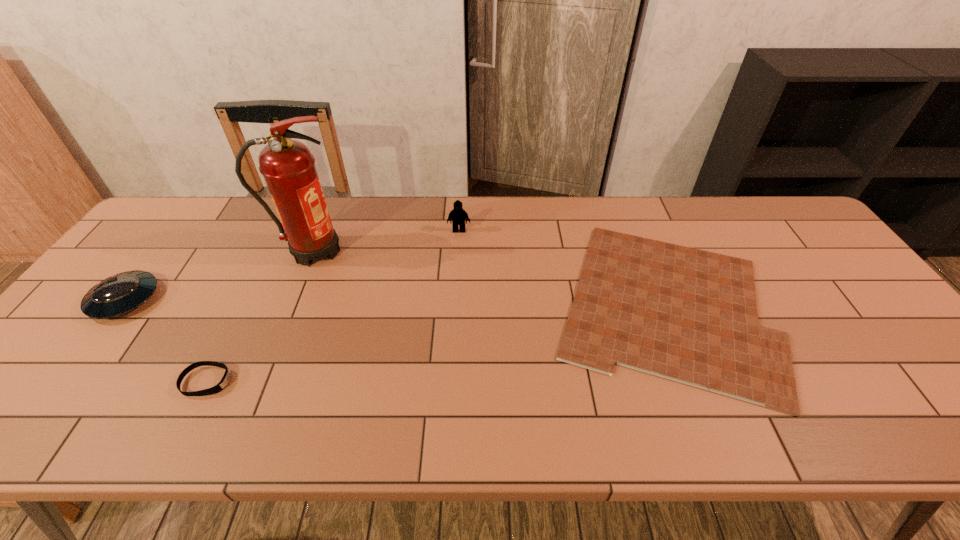
This screenshot has width=960, height=540. In order to click on free point located on the back of the leftmost object in this screenshot , I will do `click(186, 220)`.

Where is `vacant space located 0.400m on the display of the second shortest object`? This screenshot has height=540, width=960. vacant space located 0.400m on the display of the second shortest object is located at coordinates (408, 381).

Identify the location of free space located 0.380m on the left of the shortest object. This screenshot has width=960, height=540. (403, 305).

Identify the location of fire extinguisher present at the far edge. This screenshot has width=960, height=540. (288, 167).

Find the location of `Lego present at the far edge`. Lego present at the far edge is located at coordinates (457, 216).

You are a GUI agent. You are given a task and a screenshot of the screen. Output one action in this format:
    pyautogui.click(x=<x>, y=<y>)
    Task: Click on the gameboard present at the far edge
    The height and width of the screenshot is (540, 960).
    Given the screenshot: What is the action you would take?
    pyautogui.click(x=688, y=315)

I want to click on object at the near edge, so click(688, 315).

Find the location of a particular element. The height and width of the screenshot is (540, 960). object located in the left edge section of the desktop is located at coordinates point(119,294).

In the image, there is a desktop. Identify the location of vacant space at the far edge. (701, 210).

Find the location of `blank area at the near edge`. blank area at the near edge is located at coordinates (739, 415).